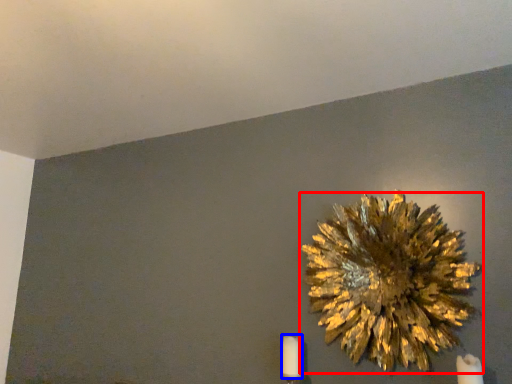
Question: Which object is closer to the camera taking this photo, flower (highlighted by a red box) or candle (highlighted by a blue box)?

Choices:
 (A) flower
 (B) candle

Answer: (A)